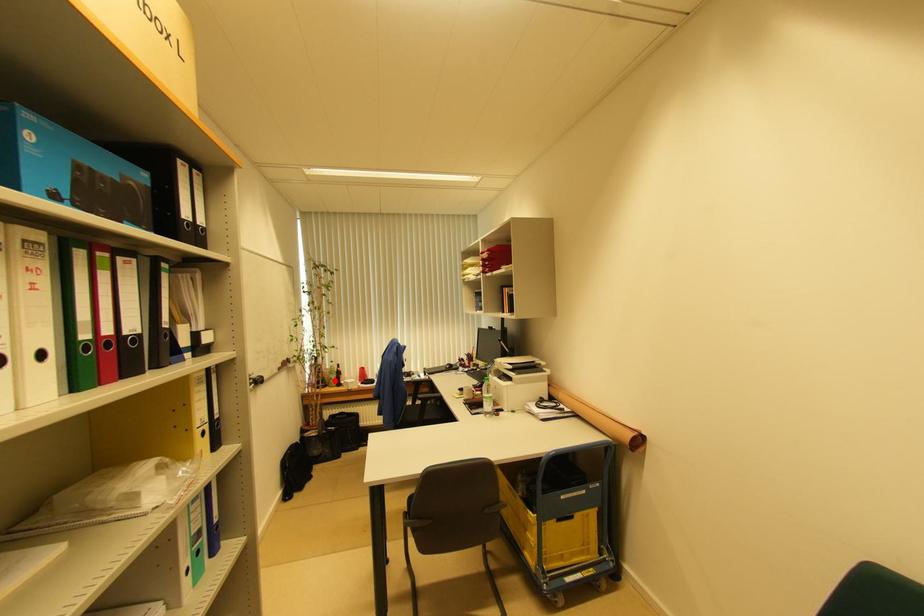
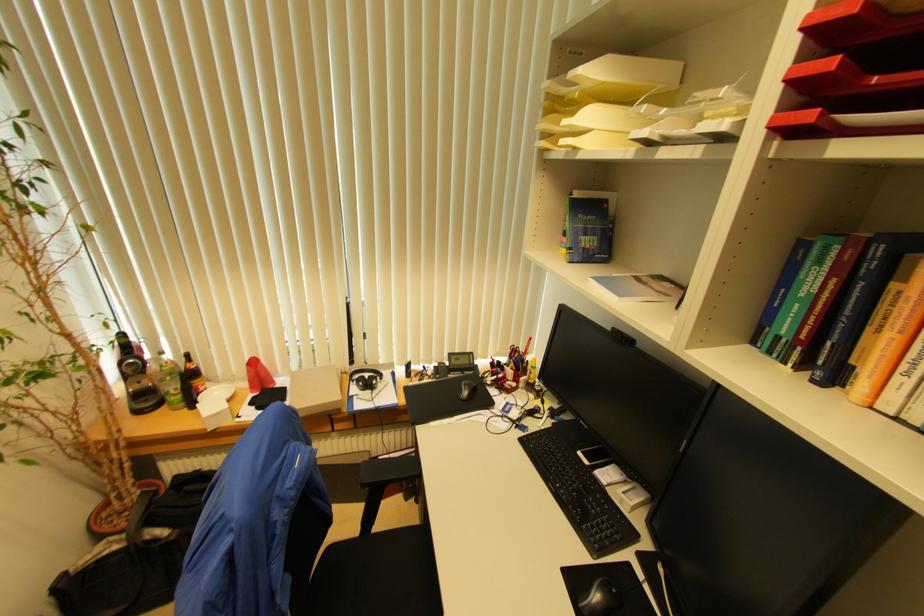
Question: I am providing you with two images of the same scene from different viewpoints. A red point is marked on the first image. Can you still see the location of the red point in image 2?

Choices:
 (A) Yes
 (B) No

Answer: (A)